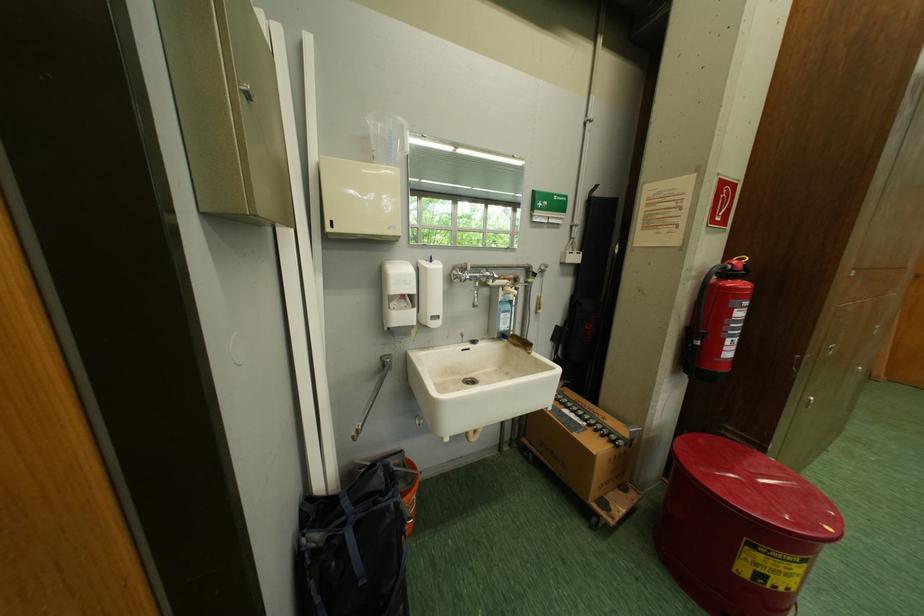
Identify the location of fire extinguisher handle. (702, 299).